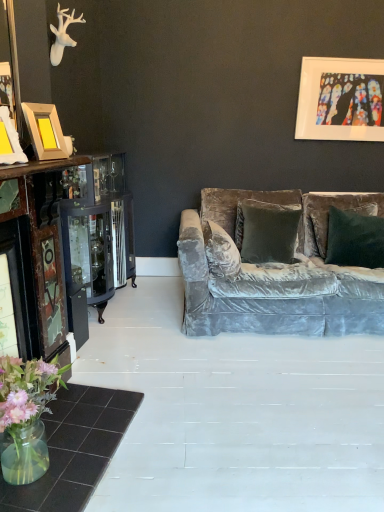
Find the location of a particular element. empty space that is ontop of stained glass artwork at upper right, the 1th picture frame in the right-to-left sequence (from a real-world perspective) is located at coordinates (351, 55).